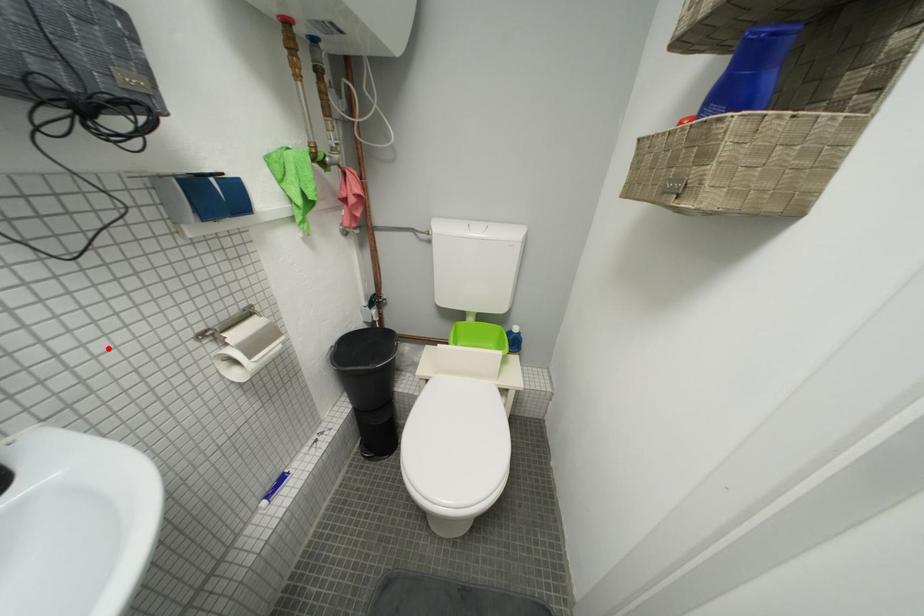
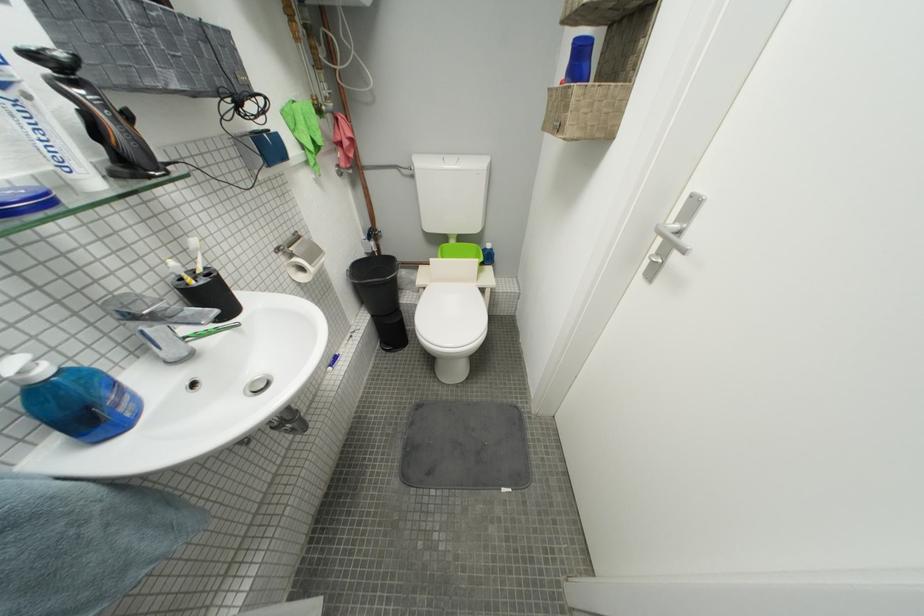
Question: A red point is marked in image1. In image2, is the corresponding 3D point closer to the camera or farther? Reply with the corresponding letter.

Choices:
 (A) The corresponding 3D point is closer.
 (B) The corresponding 3D point is farther.

Answer: (A)